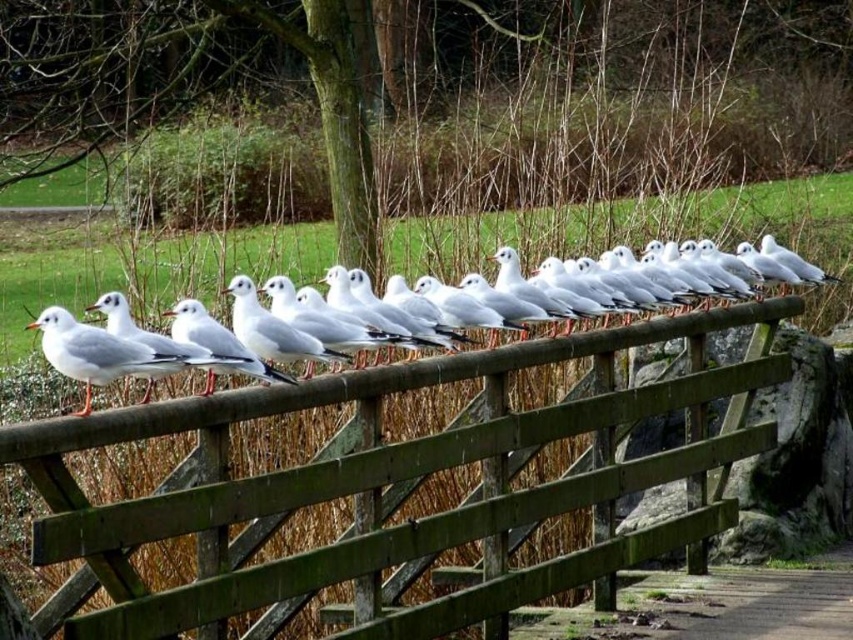
Question: Among these objects, which one is farthest from the camera?

Choices:
 (A) white matte seagull at center
 (B) wooden fence at center
 (C) white matte seagull at left

Answer: (A)

Question: Which object is the closest to the white matte seagull at center?

Choices:
 (A) wooden fence at center
 (B) white matte seagull at left

Answer: (A)

Question: Does wooden fence at center lie in front of white matte seagull at center?

Choices:
 (A) no
 (B) yes

Answer: (B)

Question: Is white matte seagull at center wider than white matte seagull at left?

Choices:
 (A) no
 (B) yes

Answer: (B)

Question: Does white matte seagull at center have a larger size compared to white matte seagull at left?

Choices:
 (A) no
 (B) yes

Answer: (B)

Question: Which is nearer to the white matte seagull at center?

Choices:
 (A) white matte seagull at left
 (B) wooden fence at center

Answer: (B)